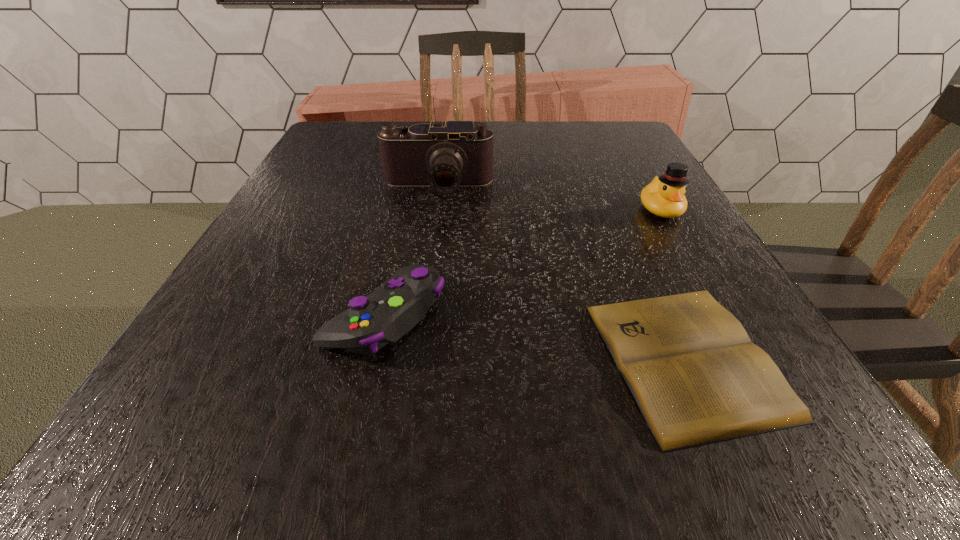
Identify the location of object identified as the third closest to the control. The height and width of the screenshot is (540, 960). (664, 196).

The width and height of the screenshot is (960, 540). I want to click on free point that satisfies the following two spatial constraints: 1. on the front-facing side of the camera; 2. on the left side of the shortest object, so point(413,358).